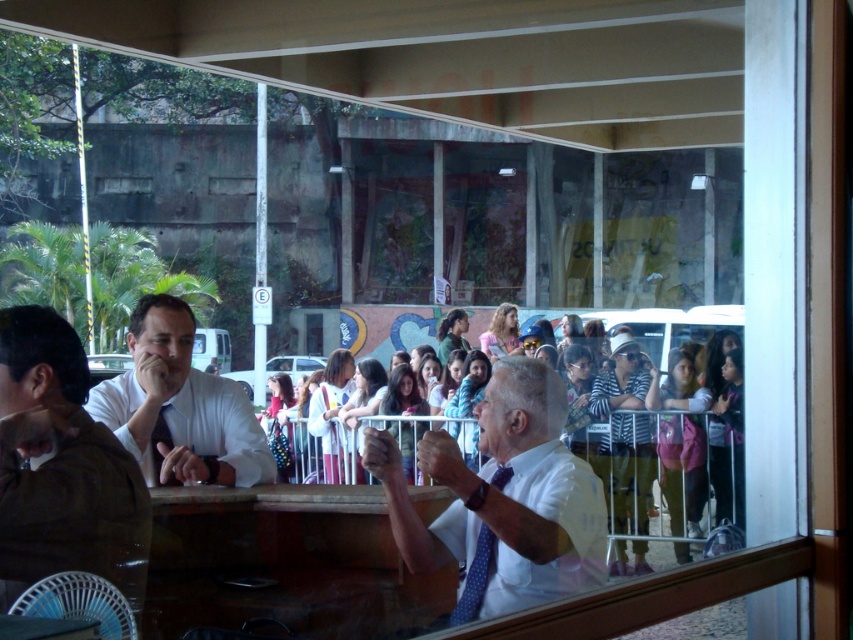
You are a photographer trying to capture both the white shirt at center and the white shirt at left in a single frame. Given their sizes, which one will appear closer to the camera in the photo?

The white shirt at center appears larger than the white shirt at left, so it will look closer to the camera in the photo.

Consider the image. You are a photographer trying to capture a clear shot of the white matte shirt at left and the matte black tie at center through the window. Since the window is slightly foggy, you need to adjust your focus. Which object should you focus on first to ensure it appears clearer in the photo?

The white matte shirt at left is taller than the matte black tie at center, so focusing on the white matte shirt at left first would ensure it appears clearer in the photo.